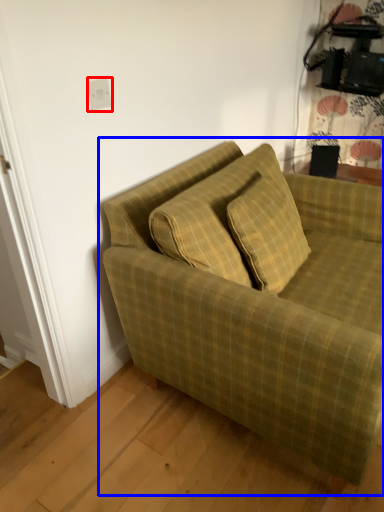
Question: Which object appears farthest to the camera in this image, electric outlet (highlighted by a red box) or studio couch (highlighted by a blue box)?

Choices:
 (A) electric outlet
 (B) studio couch

Answer: (A)